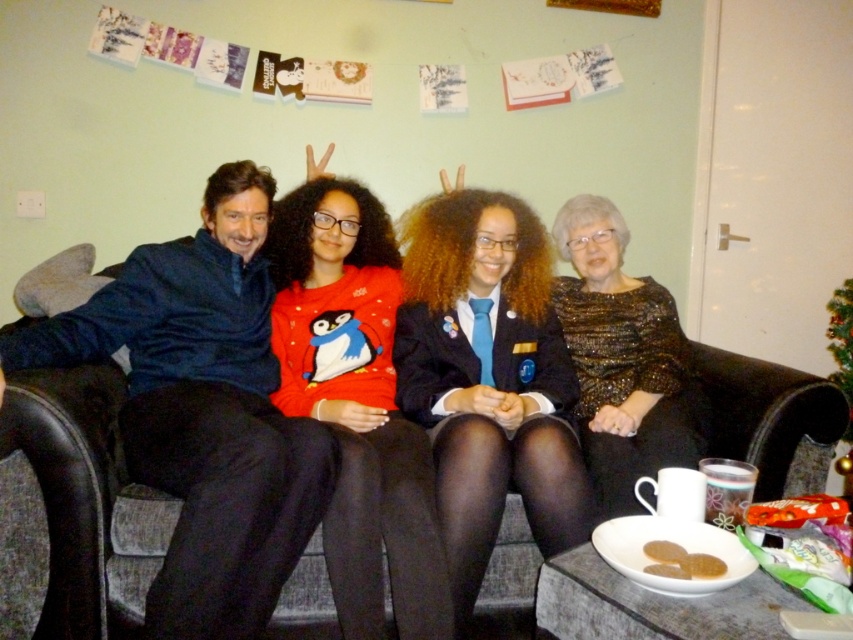
Question: Where is dark gray fabric couch at center located in relation to blue satin blazer at center in the image?

Choices:
 (A) left
 (B) right

Answer: (A)

Question: Can you confirm if blue velvet shirt at left is positioned to the left of dark gray fabric couch at center?

Choices:
 (A) yes
 (B) no

Answer: (B)

Question: Which of the following is the farthest from the observer?

Choices:
 (A) (660, 392)
 (B) (233, 394)

Answer: (A)

Question: Which point appears farthest from the camera in this image?

Choices:
 (A) (650, 458)
 (B) (492, 440)

Answer: (A)

Question: Which object is farther from the camera taking this photo?

Choices:
 (A) sparkly gold dress at center
 (B) blue satin blazer at center

Answer: (A)

Question: Can you confirm if blue velvet shirt at left is wider than blue satin blazer at center?

Choices:
 (A) no
 (B) yes

Answer: (B)